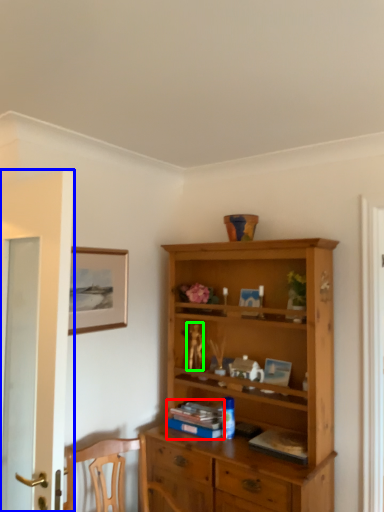
Question: Which object is the closest to the book (highlighted by a red box)? Choose among these: door (highlighted by a blue box) or toy (highlighted by a green box).

Choices:
 (A) door
 (B) toy

Answer: (B)